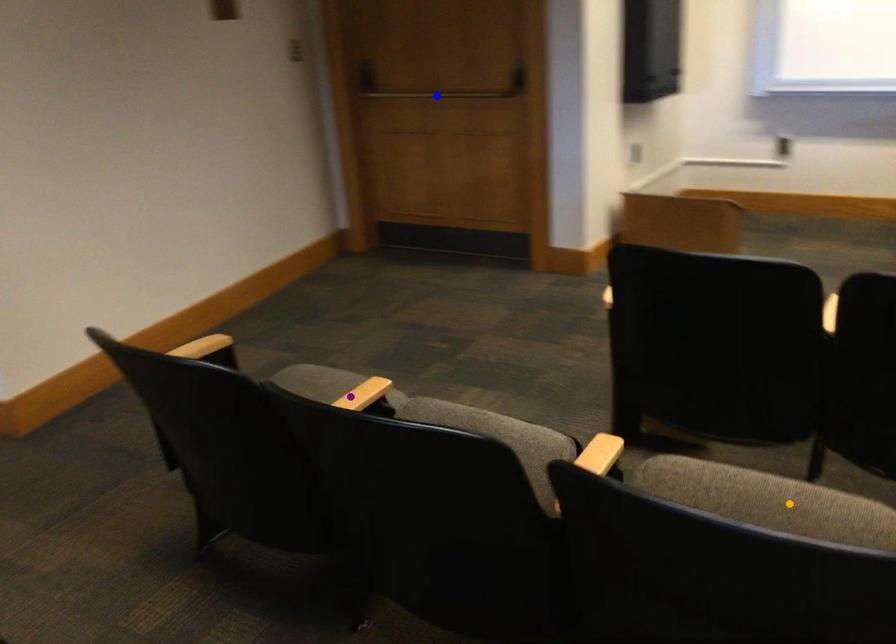
Order these from farthest to nearest:
blue point | orange point | purple point

blue point
purple point
orange point